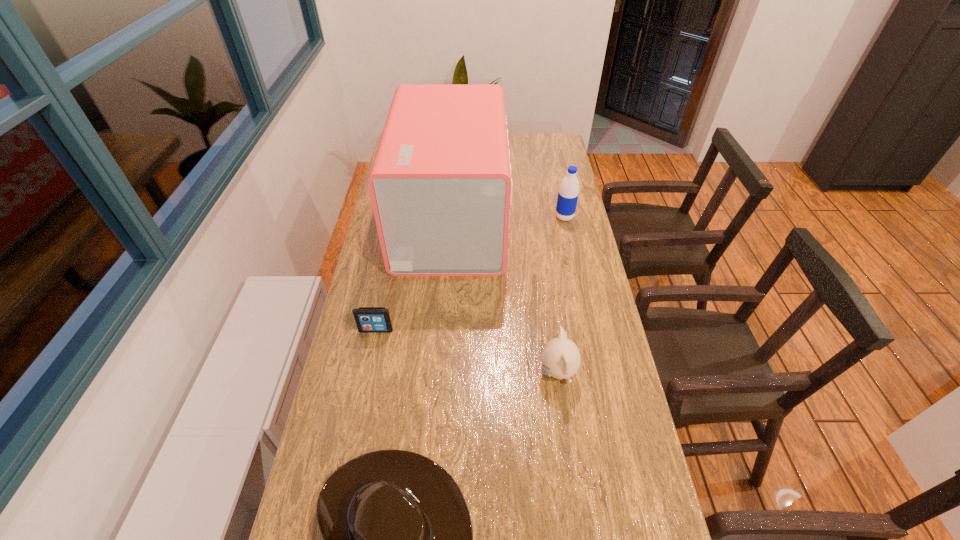
Where is `free space located on the face of the fourth object from left to right`? Image resolution: width=960 pixels, height=540 pixels. free space located on the face of the fourth object from left to right is located at coordinates (392, 373).

This screenshot has width=960, height=540. Identify the location of free spot located on the face of the fourth object from left to right. (468, 373).

I want to click on free point located 0.200m on the front screen of the iPod, so pos(363,394).

I want to click on box present at the left edge, so click(x=440, y=184).

Locate an element on the screen. iPod present at the left edge is located at coordinates (368, 319).

This screenshot has width=960, height=540. I want to click on water bottle located at the right edge, so click(568, 193).

In order to click on kitten positioned at the right edge in this screenshot , I will do `click(560, 357)`.

This screenshot has height=540, width=960. In order to click on blank space at the left edge in this screenshot , I will do `click(348, 333)`.

This screenshot has height=540, width=960. I want to click on free space at the right edge of the desktop, so click(617, 524).

The image size is (960, 540). In order to click on free space between the box and the second object from right to left in this screenshot , I will do `click(504, 296)`.